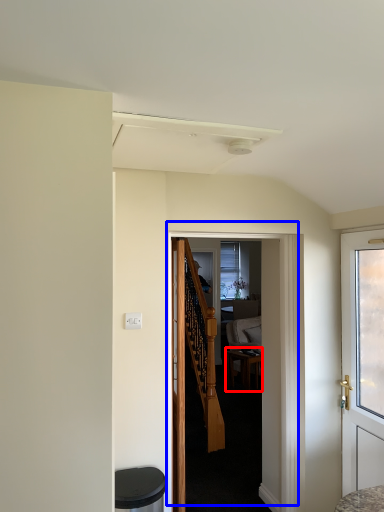
Question: Among these objects, which one is nearest to the camera, desk (highlighted by a red box) or door (highlighted by a blue box)?

Choices:
 (A) desk
 (B) door

Answer: (B)